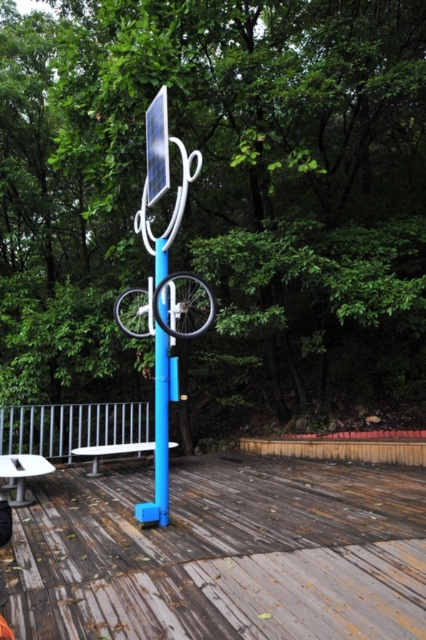
Question: Is wooden deck at center to the left of blue plastic pole at center from the viewer's perspective?

Choices:
 (A) no
 (B) yes

Answer: (A)

Question: Can you confirm if wooden deck at center is positioned to the right of white plastic picnic table at lower left?

Choices:
 (A) no
 (B) yes

Answer: (B)

Question: Which point is farther from the camera taking this photo?

Choices:
 (A) (71, 417)
 (B) (143, 337)
 (C) (131, 588)

Answer: (A)

Question: Which is farther from the blue plastic pole at center?

Choices:
 (A) white plastic bench at lower center
 (B) silver metallic rail at lower left

Answer: (B)

Question: Is the position of wooden deck at center less distant than that of white plastic bench at lower center?

Choices:
 (A) no
 (B) yes

Answer: (B)

Question: Among these objects, which one is nearest to the camera?

Choices:
 (A) wooden deck at center
 (B) blue plastic pole at center

Answer: (A)